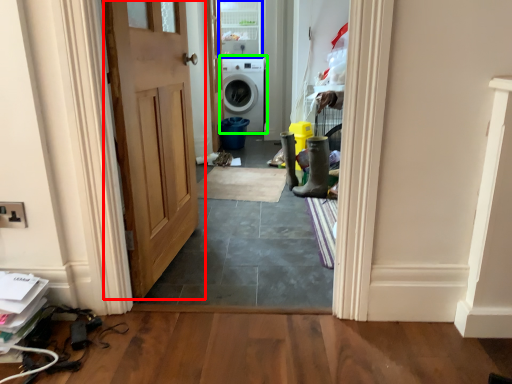
Question: Estimate the real-world distances between objects in this image. Which object is farther from door (highlighted by a red box), glass door (highlighted by a blue box) or washing machine (highlighted by a green box)?

Choices:
 (A) glass door
 (B) washing machine

Answer: (A)